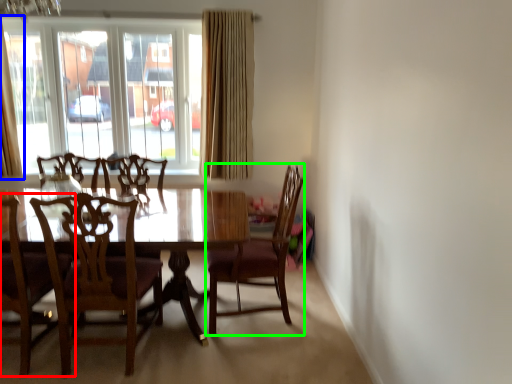
Question: Which object is positioned farthest from chair (highlighted by a red box)? Select from curtain (highlighted by a blue box) and chair (highlighted by a green box).

Choices:
 (A) curtain
 (B) chair

Answer: (A)